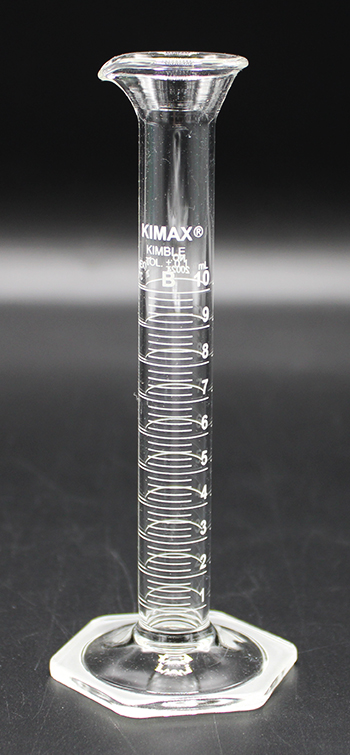
Find the location of a particular element. table is located at coordinates (317, 676).